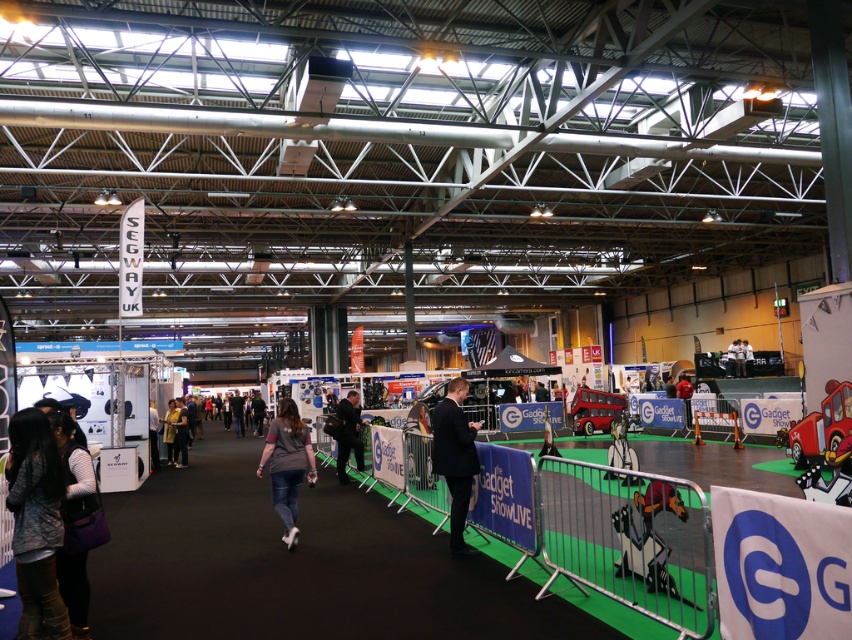
Question: Is purple fabric bag at lower left to the right of dark blue suit at center from the viewer's perspective?

Choices:
 (A) no
 (B) yes

Answer: (A)

Question: Does dark gray sweater at lower left have a greater width compared to purple fabric bag at lower left?

Choices:
 (A) yes
 (B) no

Answer: (B)

Question: Is dark gray sweater at lower left to the left of jeans at center from the viewer's perspective?

Choices:
 (A) no
 (B) yes

Answer: (B)

Question: Which point is farther to the camera?

Choices:
 (A) dark blue suit at center
 (B) light brown leather jacket at center
 (C) matte gray jacket at center
 (D) purple fabric bag at lower left

Answer: (B)

Question: Which of the following is the closest to the observer?

Choices:
 (A) yellow fabric jacket at center
 (B) jeans at center

Answer: (B)

Question: Which object is farther from the camera taking this photo?

Choices:
 (A) matte gray jacket at center
 (B) jeans at center

Answer: (A)